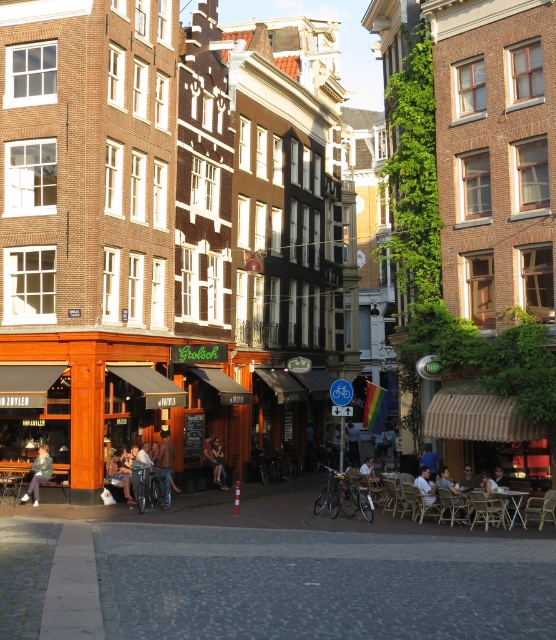
You are a photographer planning to take a picture of the leather jacket at center and denim jacket at lower left in this European street scene. Which jacket should you focus on first if you want to capture both in a single frame without moving the camera, considering their sizes?

The leather jacket at center is smaller than the denim jacket at lower left. To capture both in a single frame, focus on the denim jacket at lower left first since it is larger and might require more attention to detail, then ensure the smaller leather jacket at center is also within the frame.

Based on the photo, you are a photographer standing on the cobblestone street in the scene. You want to take a photo that includes both the smooth brown hair at lower right and the metallic silver table at center. Based on their positions, which object should appear on the left side of the photo?

The smooth brown hair at lower right is positioned to the left of the metallic silver table at center, so in the photo, the smooth brown hair at lower right will appear on the left side.